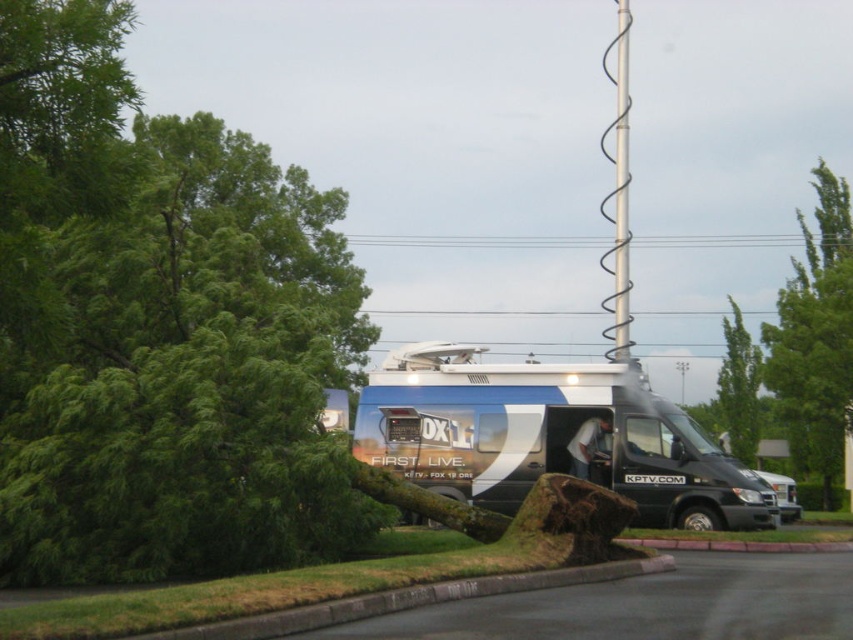
You are a delivery person trying to park your 2.5 meter wide truck between the green leafy tree at left and the metallic silver van at center. Can your truck fit in that space?

The green leafy tree at left is wider than the metallic silver van at center. Since the truck is 2.5 meters wide, it may not fit if the space between them is narrower than the truck. However, the exact width of the space isn

You are a technician assessing the scene. You see the black wire at upper center and the spiral wire at upper center. Which wire is positioned higher in the image?

The spiral wire at upper center is taller than the black wire at upper center, so the spiral wire at upper center is positioned higher in the image.

You are a delivery person who needs to park your car between the green leafy tree at left and the metallic silver van at center. Is there enough space between them?

The green leafy tree at left is to the left of the metallic silver van at center, so there is space between them for parking.